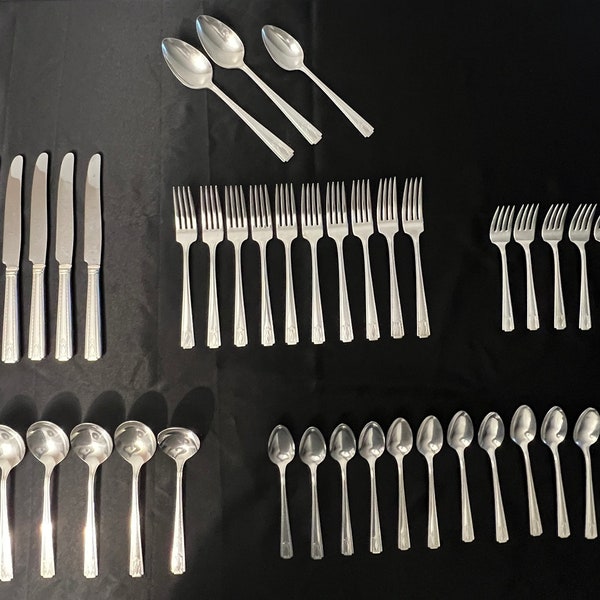
Where is `butter knives`? butter knives is located at coordinates (3, 235), (31, 231), (62, 235), (91, 240).